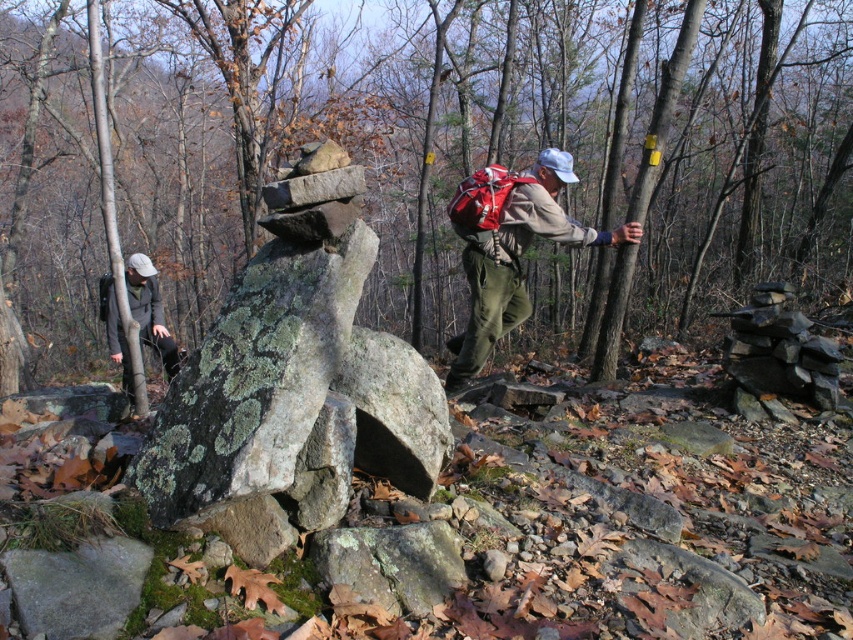
You are navigating through the forest and come across two points marked on your map. The first point is at coordinate point(305, 193) and the second at point(540, 209). Based on the scene, which point is closer to you as you face the direction of the scene?

Point(305, 193) is in front of point(540, 209), so it is closer to you as you face the scene.

You are planning to carry both the matte red backpack at center and the khaki fabric jacket at left during a hike. Considering their sizes, which one should you place in the larger storage compartment of your backpack?

The khaki fabric jacket at left is larger than the matte red backpack at center, so you should place the khaki fabric jacket at left in the larger storage compartment of your backpack.